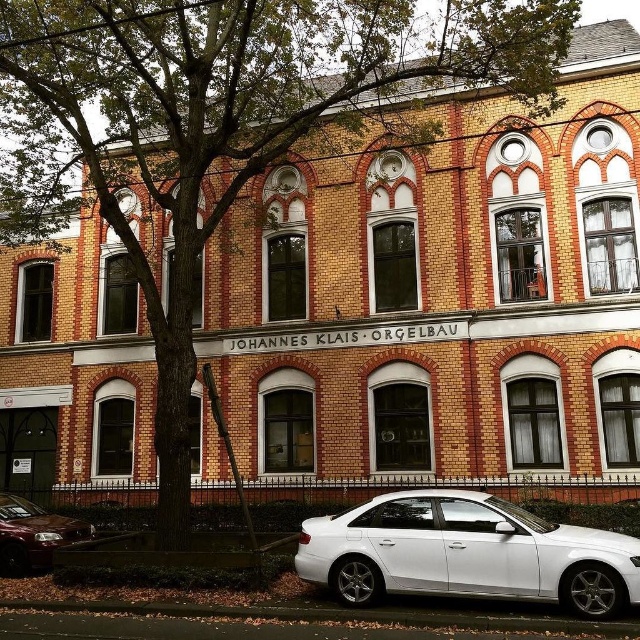
You are a delivery driver approaching the gray concrete curb at lower center and need to park your white glossy sedan at lower right. Can you park the car on the curb?

The white glossy sedan at lower right is located above the gray concrete curb at lower center, which means the curb is lower than the car. Since curbs are typically higher than the road to prevent vehicles from driving onto them, this suggests the car is parked on a higher level or the curb is not suitable for parking. Therefore, you cannot park the car on the curb.

You are a delivery driver who needs to park your truck, which is 2 meters wide, in the parking lot behind the building. The parking spot can only accommodate vehicles narrower than 2 meters. You see the white glossy sedan at lower right and the shiny red sedan at lower left in the image. Which of these two sedans has a width that would allow your truck to fit in the parking spot?

The shiny red sedan at lower left has a width smaller than 2 meters since the white glossy sedan at lower right is wider than it. Therefore, your truck cannot fit in the parking spot if the maximum allowed width is 2 meters, but the shiny red sedan at lower left might be within the limit.